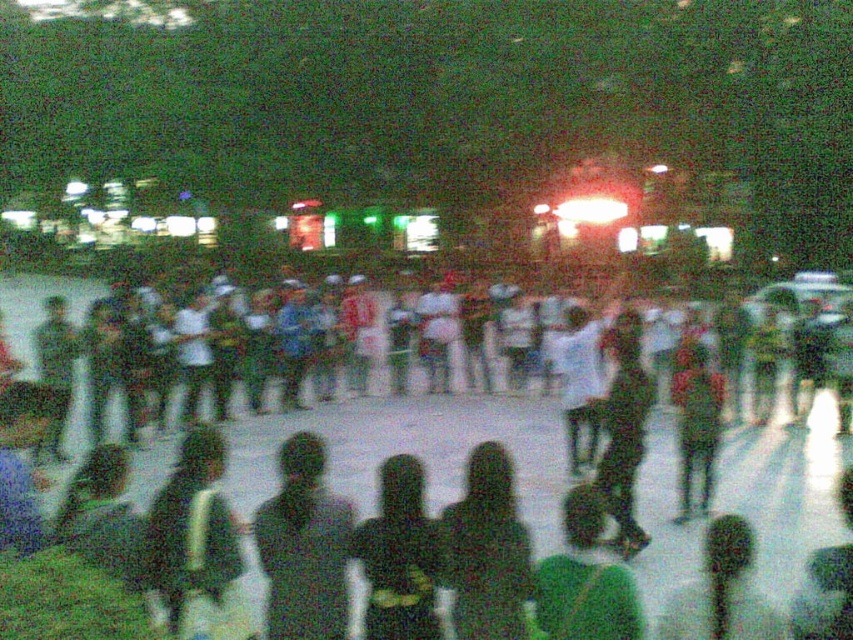
Does white glossy pavement at center have a lesser width compared to dark green fabric at center?

No, white glossy pavement at center is not thinner than dark green fabric at center.

The height and width of the screenshot is (640, 853). Identify the location of white glossy pavement at center. (412, 449).

Can you confirm if green fabric shirt at center is wider than green fabric umbrella at lower right?

No, green fabric shirt at center is not wider than green fabric umbrella at lower right.

Does green fabric shirt at center appear under green fabric umbrella at lower right?

No, green fabric shirt at center is not below green fabric umbrella at lower right.

From the picture: Who is more forward, (560, 637) or (665, 628)?

Point (560, 637) is more forward.

You are a GUI agent. You are given a task and a screenshot of the screen. Output one action in this format:
    pyautogui.click(x=<x>, y=<y>)
    Task: Click on the green fabric shirt at center
    The height and width of the screenshot is (640, 853).
    Given the screenshot: What is the action you would take?
    pyautogui.click(x=584, y=579)

Is dark green fabric jacket at center behind green fabric umbrella at lower right?

Yes, it is.

Between dark green fabric jacket at center and green fabric umbrella at lower right, which one has more height?

Standing taller between the two is dark green fabric jacket at center.

Who is more distant from viewer, (x=213, y=547) or (x=743, y=628)?

The point (x=213, y=547) is behind.

The image size is (853, 640). What are the coordinates of `dark green fabric jacket at center` in the screenshot? It's located at (196, 544).